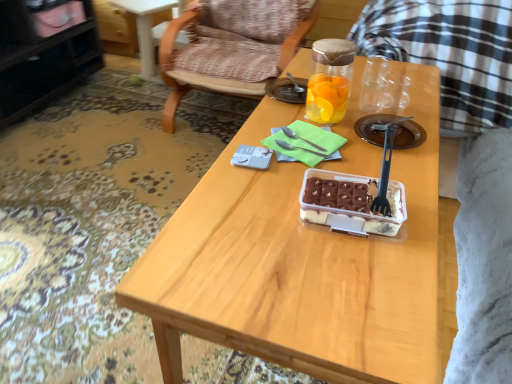
Locate an element on the screen. This screenshot has height=384, width=512. free spot behind satin silver fork at center, which appears as the first fork when viewed from the back is located at coordinates (302, 116).